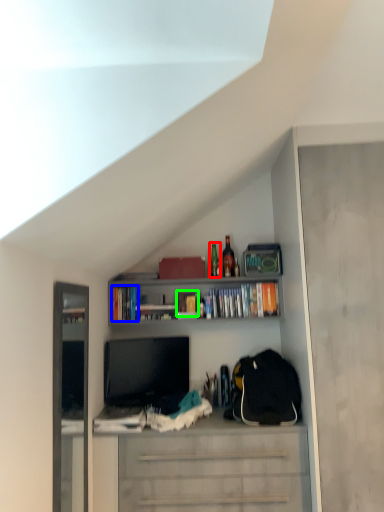
Question: Which object is positioned farthest from bottle (highlighted by a red box)? Select from book (highlighted by a blue box) and book (highlighted by a green box).

Choices:
 (A) book
 (B) book

Answer: (A)